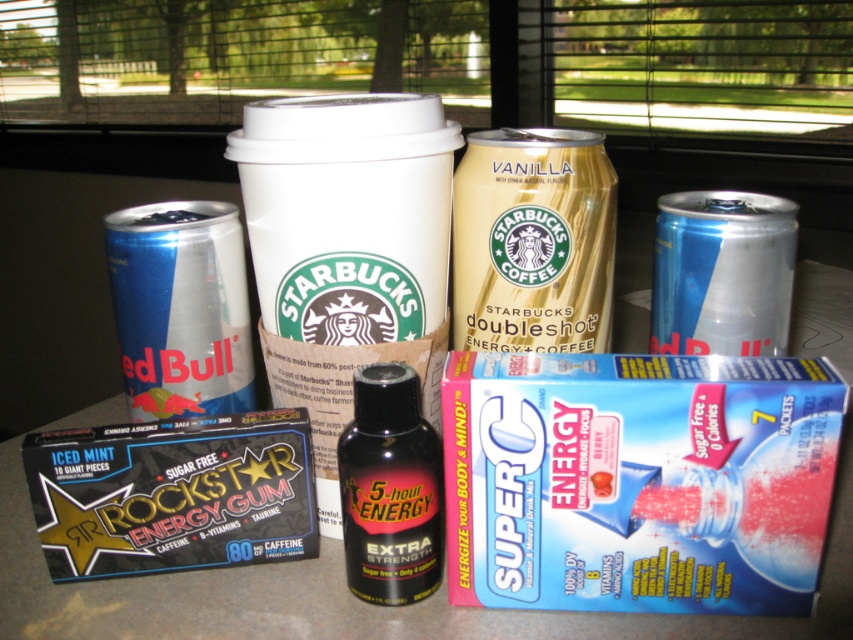
Does gold metallic can at center have a larger size compared to black plastic bottle at center?

Yes, gold metallic can at center is bigger than black plastic bottle at center.

Can you confirm if gold metallic can at center is thinner than black plastic bottle at center?

In fact, gold metallic can at center might be wider than black plastic bottle at center.

What do you see at coordinates (532, 241) in the screenshot? Image resolution: width=853 pixels, height=640 pixels. I see `gold metallic can at center` at bounding box center [532, 241].

I want to click on gold metallic can at center, so click(x=532, y=241).

From the picture: Who is more distant from viewer, (479,152) or (775,246)?

The point (775,246) is more distant.

Find the location of a particular element. gold metallic can at center is located at coordinates (532, 241).

Can you confirm if gold metallic can at center is positioned above blue metallic can at left?

Yes.

Who is shorter, gold metallic can at center or blue metallic can at left?

gold metallic can at center

Between point (573, 308) and point (154, 232), which one is positioned in front?

Point (154, 232)

You are a GUI agent. You are given a task and a screenshot of the screen. Output one action in this format:
    pyautogui.click(x=<x>, y=<y>)
    Task: Click on the gold metallic can at center
    
    Given the screenshot: What is the action you would take?
    pyautogui.click(x=532, y=241)